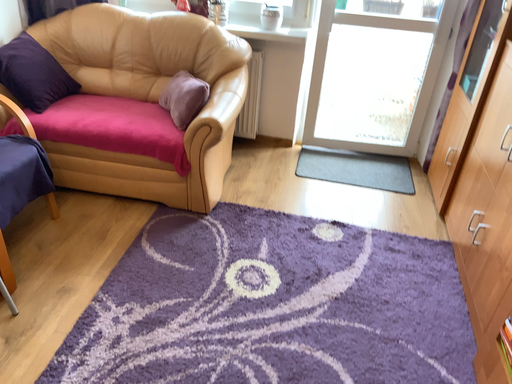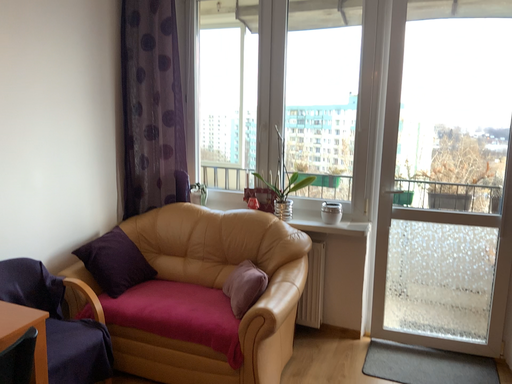
Question: How did the camera likely rotate when shooting the video?

Choices:
 (A) rotated right
 (B) rotated left

Answer: (B)